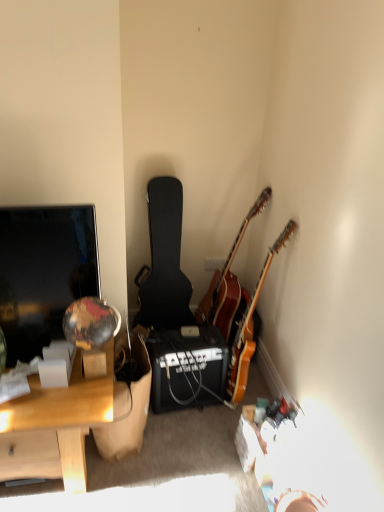
Question: Should I look upward or downward to see black matte amplifier at center?

Choices:
 (A) up
 (B) down

Answer: (B)

Question: Is black matte amplifier at center located outside wooden acoustic guitar at corner, which is the second guitar in left-to-right order?

Choices:
 (A) no
 (B) yes

Answer: (B)

Question: Is black matte amplifier at center at the right side of wooden acoustic guitar at corner, which is the 2th guitar in right-to-left order?

Choices:
 (A) yes
 (B) no

Answer: (B)

Question: From a real-world perspective, is black matte amplifier at center located higher than wooden acoustic guitar at corner, which is the 2th guitar in right-to-left order?

Choices:
 (A) no
 (B) yes

Answer: (A)

Question: Does black matte amplifier at center touch wooden acoustic guitar at corner, which is the 2th guitar in right-to-left order?

Choices:
 (A) no
 (B) yes

Answer: (A)

Question: Is black matte amplifier at center wider than wooden acoustic guitar at corner, which is the second guitar in left-to-right order?

Choices:
 (A) yes
 (B) no

Answer: (B)

Question: Is black matte amplifier at center positioned behind wooden acoustic guitar at corner, which is the second guitar in left-to-right order?

Choices:
 (A) yes
 (B) no

Answer: (B)

Question: Is wooden acoustic guitar at corner, which is the second guitar in left-to-right order, closer to camera compared to wooden desk at left?

Choices:
 (A) no
 (B) yes

Answer: (A)

Question: Is wooden acoustic guitar at corner, which is the second guitar in left-to-right order, shorter than wooden desk at left?

Choices:
 (A) yes
 (B) no

Answer: (B)

Question: From a real-world perspective, is wooden acoustic guitar at corner, which is the second guitar in left-to-right order, under wooden desk at left?

Choices:
 (A) yes
 (B) no

Answer: (B)

Question: Considering the relative sizes of wooden acoustic guitar at corner, which is the 2th guitar in right-to-left order, and wooden desk at left in the image provided, is wooden acoustic guitar at corner, which is the 2th guitar in right-to-left order, bigger than wooden desk at left?

Choices:
 (A) no
 (B) yes

Answer: (A)

Question: Is wooden acoustic guitar at corner, which is the 2th guitar in right-to-left order, behind wooden desk at left?

Choices:
 (A) no
 (B) yes

Answer: (B)

Question: From the image's perspective, does wooden acoustic guitar at corner, which is the second guitar in left-to-right order, appear higher than wooden desk at left?

Choices:
 (A) no
 (B) yes

Answer: (B)

Question: Is wooden desk at left wider than black textured guitar case at center, the 3th guitar viewed from the right?

Choices:
 (A) no
 (B) yes

Answer: (B)